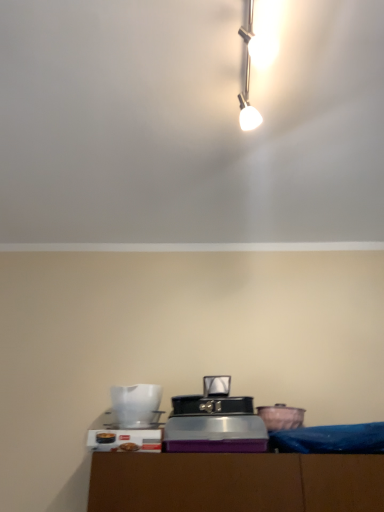
Locate an element on the screen. Image resolution: width=384 pixels, height=512 pixels. white glossy pitcher at lower left, the second appliance from the right is located at coordinates (136, 405).

You are a GUI agent. You are given a task and a screenshot of the screen. Output one action in this format:
    pyautogui.click(x=<x>, y=<y>)
    Task: Click on the white glossy pitcher at lower left, arranged as the 2th appliance when viewed from the left
    The height and width of the screenshot is (512, 384).
    Given the screenshot: What is the action you would take?
    pyautogui.click(x=136, y=405)

Based on the photo, which of these two, matte pink ceramic bowl at lower right, acting as the 1th appliance starting from the right, or white plastic toaster at lower center, marked as the third appliance in a right-to-left arrangement, stands taller?

white plastic toaster at lower center, marked as the third appliance in a right-to-left arrangement.

Is matte pink ceramic bowl at lower right, acting as the 1th appliance starting from the right, wider or thinner than white plastic toaster at lower center, which appears as the 1th appliance when viewed from the left?

Considering their sizes, matte pink ceramic bowl at lower right, acting as the 1th appliance starting from the right, looks slimmer than white plastic toaster at lower center, which appears as the 1th appliance when viewed from the left.

Which point is more forward, (288, 411) or (144, 428)?

The point (144, 428) is closer.

Between matte pink ceramic bowl at lower right, which is the third appliance in left-to-right order, and white plastic toaster at lower center, marked as the third appliance in a right-to-left arrangement, which one has smaller size?

matte pink ceramic bowl at lower right, which is the third appliance in left-to-right order, is smaller.

Considering their positions, is matte pink ceramic bowl at lower right, acting as the 1th appliance starting from the right, located in front of or behind white glossy pitcher at lower left, the second appliance from the right?

matte pink ceramic bowl at lower right, acting as the 1th appliance starting from the right, is positioned farther from the viewer than white glossy pitcher at lower left, the second appliance from the right.

Measure the distance from matte pink ceramic bowl at lower right, acting as the 1th appliance starting from the right, to white glossy pitcher at lower left, the second appliance from the right.

They are 20.96 inches apart.

From a real-world perspective, who is located higher, matte pink ceramic bowl at lower right, acting as the 1th appliance starting from the right, or white glossy pitcher at lower left, arranged as the 2th appliance when viewed from the left?

In real-world perspective, white glossy pitcher at lower left, arranged as the 2th appliance when viewed from the left, is above.

Considering the points (276, 426) and (109, 412), which point is in front, point (276, 426) or point (109, 412)?

The point (276, 426) is in front.

From a real-world perspective, is white plastic toaster at lower center, which appears as the 1th appliance when viewed from the left, positioned under white glossy pitcher at lower left, arranged as the 2th appliance when viewed from the left, based on gravity?

Yes, from a real-world perspective, white plastic toaster at lower center, which appears as the 1th appliance when viewed from the left, is beneath white glossy pitcher at lower left, arranged as the 2th appliance when viewed from the left.

From the picture: Which is farther, (101, 448) or (149, 422)?

The point (149, 422) is more distant.

Is white plastic toaster at lower center, which appears as the 1th appliance when viewed from the left, shorter than white glossy pitcher at lower left, the second appliance from the right?

Yes, white plastic toaster at lower center, which appears as the 1th appliance when viewed from the left, is shorter than white glossy pitcher at lower left, the second appliance from the right.

Could you tell me if white plastic toaster at lower center, which appears as the 1th appliance when viewed from the left, is facing white glossy pitcher at lower left, the second appliance from the right?

No, white plastic toaster at lower center, which appears as the 1th appliance when viewed from the left, is not facing towards white glossy pitcher at lower left, the second appliance from the right.

I want to click on the 1st appliance behind the white plastic toaster at lower center, which appears as the 1th appliance when viewed from the left, so click(x=136, y=405).

Looking at their sizes, would you say white glossy pitcher at lower left, the second appliance from the right, is wider or thinner than white plastic toaster at lower center, marked as the third appliance in a right-to-left arrangement?

Clearly, white glossy pitcher at lower left, the second appliance from the right, has more width compared to white plastic toaster at lower center, marked as the third appliance in a right-to-left arrangement.

Does white glossy pitcher at lower left, arranged as the 2th appliance when viewed from the left, turn towards white plastic toaster at lower center, which appears as the 1th appliance when viewed from the left?

No, white glossy pitcher at lower left, arranged as the 2th appliance when viewed from the left, is not turned towards white plastic toaster at lower center, which appears as the 1th appliance when viewed from the left.

Considering the sizes of objects white glossy pitcher at lower left, the second appliance from the right, and white plastic toaster at lower center, marked as the third appliance in a right-to-left arrangement, in the image provided, who is bigger, white glossy pitcher at lower left, the second appliance from the right, or white plastic toaster at lower center, marked as the third appliance in a right-to-left arrangement,?

white glossy pitcher at lower left, the second appliance from the right, is bigger.

Is white glossy pitcher at lower left, arranged as the 2th appliance when viewed from the left, in front of or behind matte pink ceramic bowl at lower right, which is the third appliance in left-to-right order, in the image?

white glossy pitcher at lower left, arranged as the 2th appliance when viewed from the left, is positioned closer to the viewer than matte pink ceramic bowl at lower right, which is the third appliance in left-to-right order.

Does point (140, 416) come in front of point (271, 407)?

Yes, point (140, 416) is closer to viewer.

How far apart are white glossy pitcher at lower left, arranged as the 2th appliance when viewed from the left, and matte pink ceramic bowl at lower right, which is the third appliance in left-to-right order?

white glossy pitcher at lower left, arranged as the 2th appliance when viewed from the left, is 20.96 inches from matte pink ceramic bowl at lower right, which is the third appliance in left-to-right order.

From the image's perspective, is white glossy pitcher at lower left, the second appliance from the right, above or below matte pink ceramic bowl at lower right, acting as the 1th appliance starting from the right?

Based on their image positions, white glossy pitcher at lower left, the second appliance from the right, is located above matte pink ceramic bowl at lower right, acting as the 1th appliance starting from the right.

Looking at their sizes, would you say white plastic toaster at lower center, which appears as the 1th appliance when viewed from the left, is wider or thinner than matte pink ceramic bowl at lower right, acting as the 1th appliance starting from the right?

Clearly, white plastic toaster at lower center, which appears as the 1th appliance when viewed from the left, has more width compared to matte pink ceramic bowl at lower right, acting as the 1th appliance starting from the right.

Which appliance is the 2nd one when counting from the left side of the matte pink ceramic bowl at lower right, acting as the 1th appliance starting from the right? Please provide its 2D coordinates.

[(128, 435)]

Is white plastic toaster at lower center, which appears as the 1th appliance when viewed from the left, far away from matte pink ceramic bowl at lower right, which is the third appliance in left-to-right order?

white plastic toaster at lower center, which appears as the 1th appliance when viewed from the left, is actually quite close to matte pink ceramic bowl at lower right, which is the third appliance in left-to-right order.

Between white plastic toaster at lower center, which appears as the 1th appliance when viewed from the left, and matte pink ceramic bowl at lower right, acting as the 1th appliance starting from the right, which one appears on the left side from the viewer's perspective?

Positioned to the left is white plastic toaster at lower center, which appears as the 1th appliance when viewed from the left.

This screenshot has height=512, width=384. Find the location of `appliance below the matte pink ceramic bowl at lower right, acting as the 1th appliance starting from the right (from the image's perspective)`. appliance below the matte pink ceramic bowl at lower right, acting as the 1th appliance starting from the right (from the image's perspective) is located at coordinates (128, 435).

Locate an element on the screen. This screenshot has width=384, height=512. appliance behind the white glossy pitcher at lower left, the second appliance from the right is located at coordinates (281, 417).

In the scene shown: Considering their positions, is white plastic toaster at lower center, which appears as the 1th appliance when viewed from the left, positioned closer to white glossy pitcher at lower left, arranged as the 2th appliance when viewed from the left, than matte pink ceramic bowl at lower right, which is the third appliance in left-to-right order?

white plastic toaster at lower center, which appears as the 1th appliance when viewed from the left.

Based on their spatial positions, is matte pink ceramic bowl at lower right, acting as the 1th appliance starting from the right, or white plastic toaster at lower center, which appears as the 1th appliance when viewed from the left, further from white glossy pitcher at lower left, the second appliance from the right?

matte pink ceramic bowl at lower right, acting as the 1th appliance starting from the right, is further to white glossy pitcher at lower left, the second appliance from the right.

Based on their spatial positions, is white plastic toaster at lower center, marked as the third appliance in a right-to-left arrangement, or white glossy pitcher at lower left, arranged as the 2th appliance when viewed from the left, closer to matte pink ceramic bowl at lower right, acting as the 1th appliance starting from the right?

Based on the image, white glossy pitcher at lower left, arranged as the 2th appliance when viewed from the left, appears to be nearer to matte pink ceramic bowl at lower right, acting as the 1th appliance starting from the right.

From the image, which object appears to be farther from white plastic toaster at lower center, which appears as the 1th appliance when viewed from the left, white glossy pitcher at lower left, the second appliance from the right, or matte pink ceramic bowl at lower right, acting as the 1th appliance starting from the right?

Based on the image, matte pink ceramic bowl at lower right, acting as the 1th appliance starting from the right, appears to be further to white plastic toaster at lower center, which appears as the 1th appliance when viewed from the left.

Estimate the real-world distances between objects in this image. Which object is closer to matte pink ceramic bowl at lower right, which is the third appliance in left-to-right order, white glossy pitcher at lower left, arranged as the 2th appliance when viewed from the left, or white plastic toaster at lower center, marked as the third appliance in a right-to-left arrangement?

white glossy pitcher at lower left, arranged as the 2th appliance when viewed from the left, is closer to matte pink ceramic bowl at lower right, which is the third appliance in left-to-right order.

Looking at the image, which one is located closer to white plastic toaster at lower center, which appears as the 1th appliance when viewed from the left, matte pink ceramic bowl at lower right, acting as the 1th appliance starting from the right, or white glossy pitcher at lower left, arranged as the 2th appliance when viewed from the left?

white glossy pitcher at lower left, arranged as the 2th appliance when viewed from the left.

Find the location of `appliance situated between white plastic toaster at lower center, which appears as the 1th appliance when viewed from the left, and matte pink ceramic bowl at lower right, acting as the 1th appliance starting from the right, from left to right`. appliance situated between white plastic toaster at lower center, which appears as the 1th appliance when viewed from the left, and matte pink ceramic bowl at lower right, acting as the 1th appliance starting from the right, from left to right is located at coordinates (136, 405).